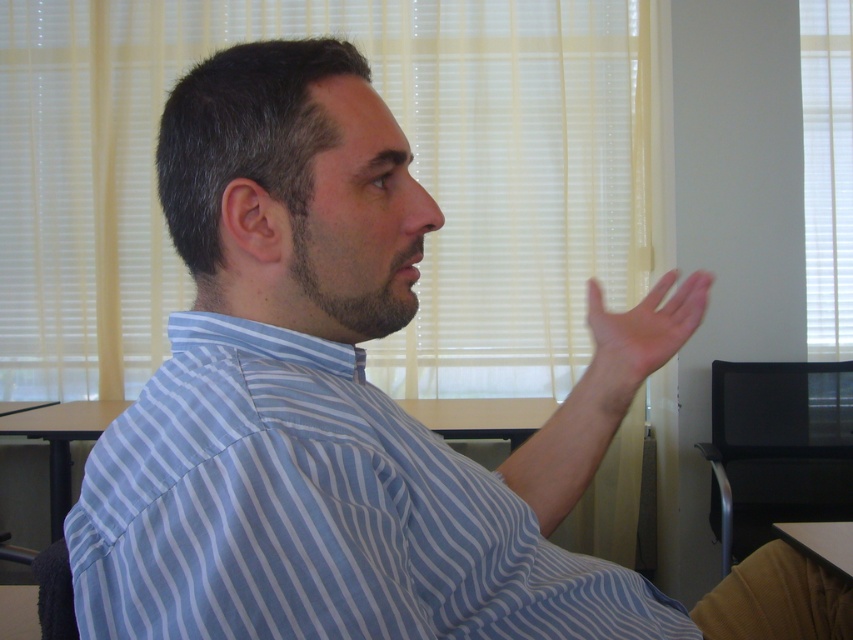
You are an interior designer assessing the room layout. The blue striped shirt at center and the black plastic table at lower right are both in view. Which object occupies a larger vertical space in the image?

The blue striped shirt at center is much taller than the black plastic table at lower right, so it occupies a larger vertical space in the image.

You are standing in the room where the man is speaking. There are two points marked in the image. The first point is at coordinates point (282, 157) and the second is at point (840, 564). Which point is closer to you?

Point (282, 157) is closer to the viewer than point (840, 564).

You are organizing a small event and need to place a 1.2 meter wide banner between the skinny flesh at right and the brown wooden desk at lower left. Based on their sizes, will the banner fit between them?

The skinny flesh at right is smaller than the brown wooden desk at lower left, so the banner may fit between them depending on the exact distance, but the size comparison alone doesn not confirm the space availability.